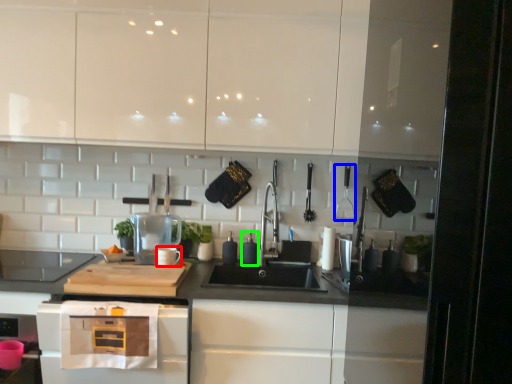
Question: Based on their relative distances, which object is farther from appliance (highlighted by a red box)? Choose from appliance (highlighted by a blue box) and appliance (highlighted by a green box).

Choices:
 (A) appliance
 (B) appliance

Answer: (A)